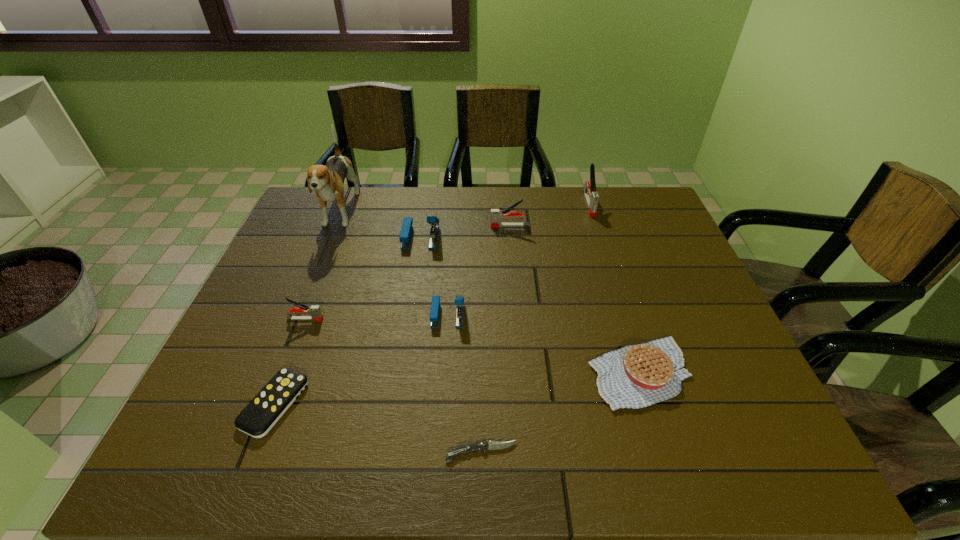
Locate an element on the screen. the nearer blue stapler is located at coordinates (459, 301).

Find the location of `the right blue stapler`. the right blue stapler is located at coordinates (459, 301).

Image resolution: width=960 pixels, height=540 pixels. Find the location of `brown pie`. brown pie is located at coordinates (636, 376).

What are the coordinates of `the third shortest object` in the screenshot? It's located at (636, 376).

The height and width of the screenshot is (540, 960). I want to click on remote control, so click(268, 406).

Find the location of `pocketknife`. pocketknife is located at coordinates (484, 446).

Identify the location of the nearest object. The height and width of the screenshot is (540, 960). (484, 446).

Find the location of a particular element. The image size is (960, 540). free space located 0.160m at the face of the tallest object is located at coordinates (315, 276).

Identify the location of vacant space located 0.140m on the handle side of the rightmost stapler. (602, 244).

This screenshot has height=540, width=960. I want to click on free region located on the handle side of the second stapler from right to left, so click(x=459, y=226).